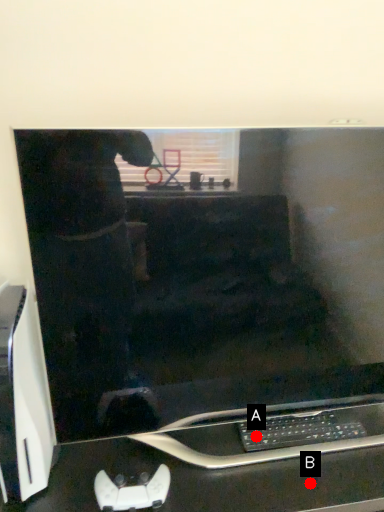
Question: Two points are circled on the image, labeled by A and B beside each circle. Among these points, which one is farthest from the camera?

Choices:
 (A) A is further
 (B) B is further

Answer: (A)